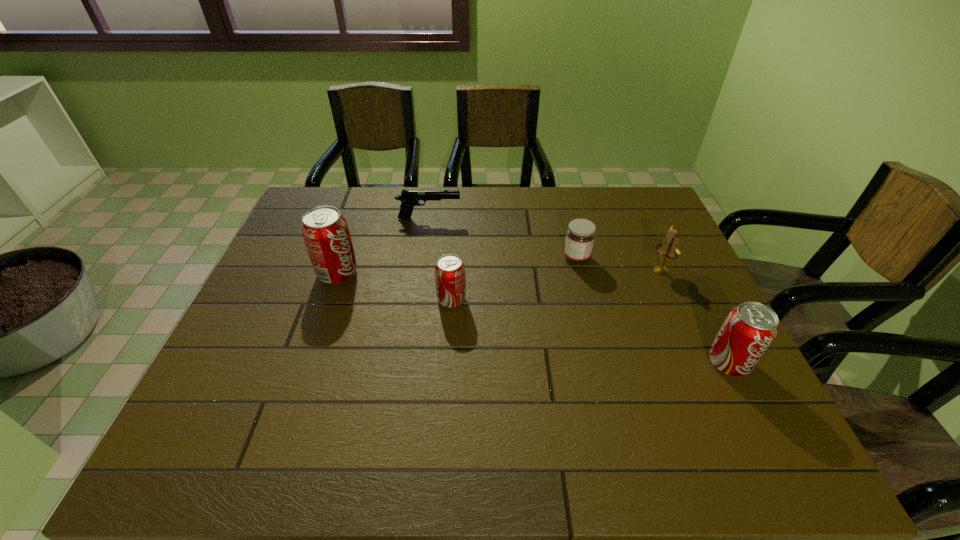
Locate an element on the screen. object at the near right corner is located at coordinates (748, 331).

Image resolution: width=960 pixels, height=540 pixels. Find the location of `vacant region at the far edge of the desktop`. vacant region at the far edge of the desktop is located at coordinates (547, 193).

In the image, there is a desktop. Where is `vacant space at the near edge`? The image size is (960, 540). vacant space at the near edge is located at coordinates (389, 391).

This screenshot has height=540, width=960. I want to click on free space at the left edge, so click(x=266, y=293).

Image resolution: width=960 pixels, height=540 pixels. Find the location of `free spot at the right edge of the desktop`. free spot at the right edge of the desktop is located at coordinates (698, 280).

This screenshot has height=540, width=960. Identify the location of free region at the far left corner of the desktop. (344, 191).

In the image, there is a desktop. At what (x,y) coordinates should I click in order to perform the action: click on vacant space at the far right corner. Please return your answer as a coordinate pair (x, y). Image resolution: width=960 pixels, height=540 pixels. Looking at the image, I should click on (632, 214).

The height and width of the screenshot is (540, 960). Identify the location of free region at the near right corner of the desktop. (754, 414).

Locate an element on the screen. The image size is (960, 540). free space between the rightmost soda and the jam is located at coordinates (653, 310).

You are a GUI agent. You are given a task and a screenshot of the screen. Output one action in this format:
    pyautogui.click(x=<x>, y=<y>)
    Task: Click on the empty space that is in between the jam and the shortest soda
    
    Given the screenshot: What is the action you would take?
    pyautogui.click(x=514, y=279)